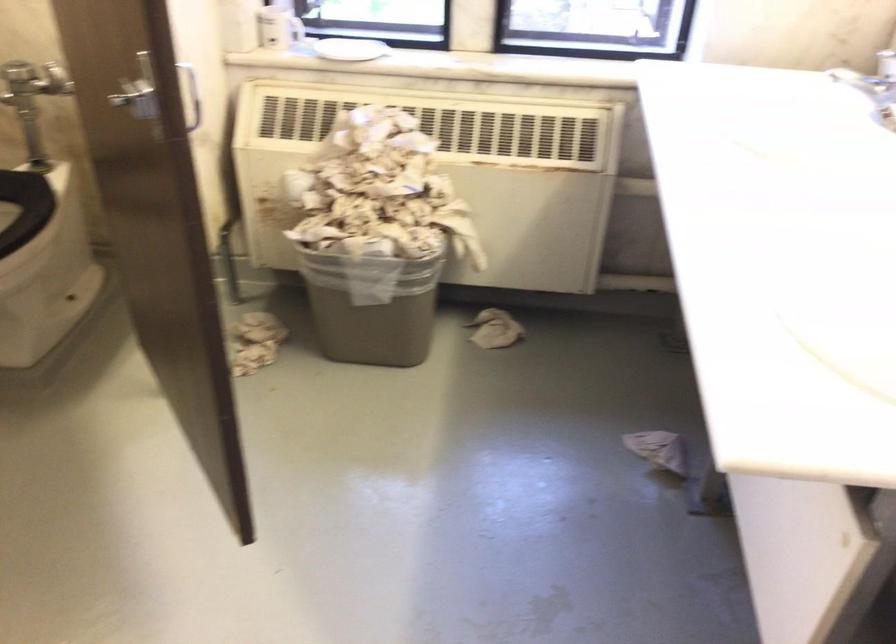
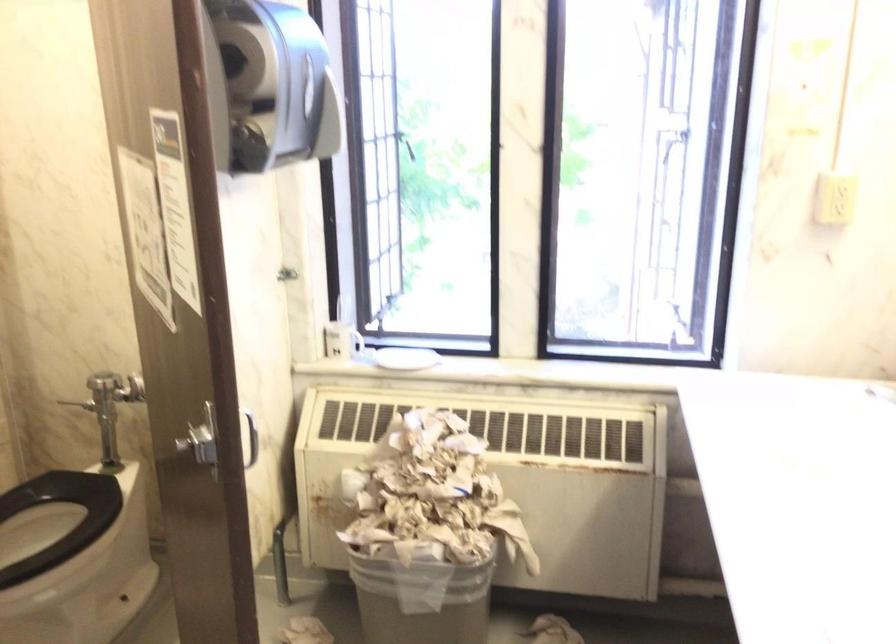
What movement of the cameraman would produce the second image?

The cameraman moved toward right, backward.